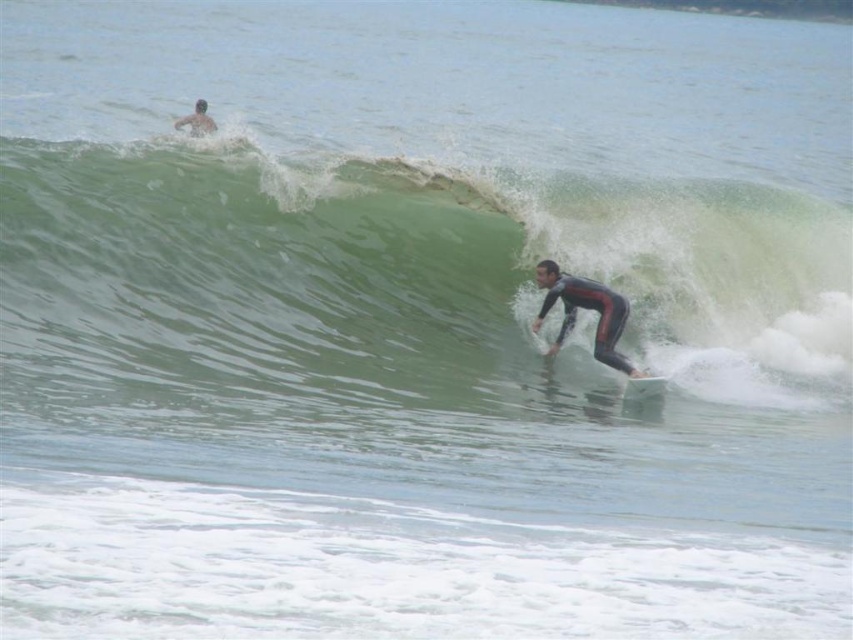
Who is taller, skinny man at upper left or white foam surfboard at center?

Standing taller between the two is skinny man at upper left.

Does point (183, 120) lie in front of point (641, 388)?

No, (183, 120) is behind (641, 388).

The image size is (853, 640). Identify the location of skinny man at upper left. (196, 120).

This screenshot has width=853, height=640. Identify the location of skinny man at upper left. (196, 120).

Where is `green rubber wave at center`? green rubber wave at center is located at coordinates (387, 280).

Is green rubber wave at center positioned in front of black matte wetsuit at center?

Yes, green rubber wave at center is in front of black matte wetsuit at center.

Is point (173, 307) in front of point (608, 291)?

Yes, point (173, 307) is in front of point (608, 291).

This screenshot has width=853, height=640. I want to click on green rubber wave at center, so click(x=387, y=280).

Which is behind, point (619, 308) or point (198, 128)?

The point (198, 128) is behind.

Can you confirm if black matte wetsuit at center is wider than skinny man at upper left?

In fact, black matte wetsuit at center might be narrower than skinny man at upper left.

Where is `black matte wetsuit at center`? black matte wetsuit at center is located at coordinates (584, 308).